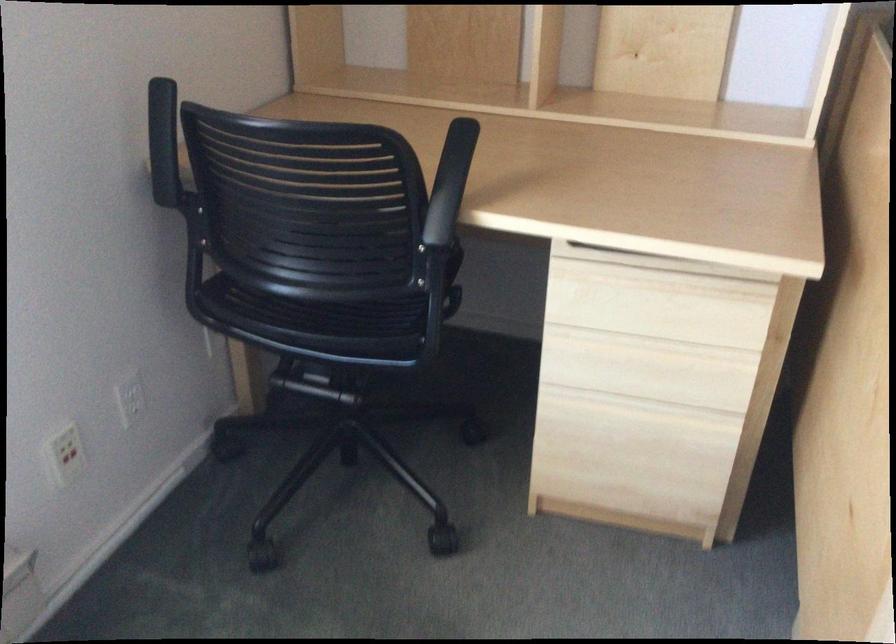
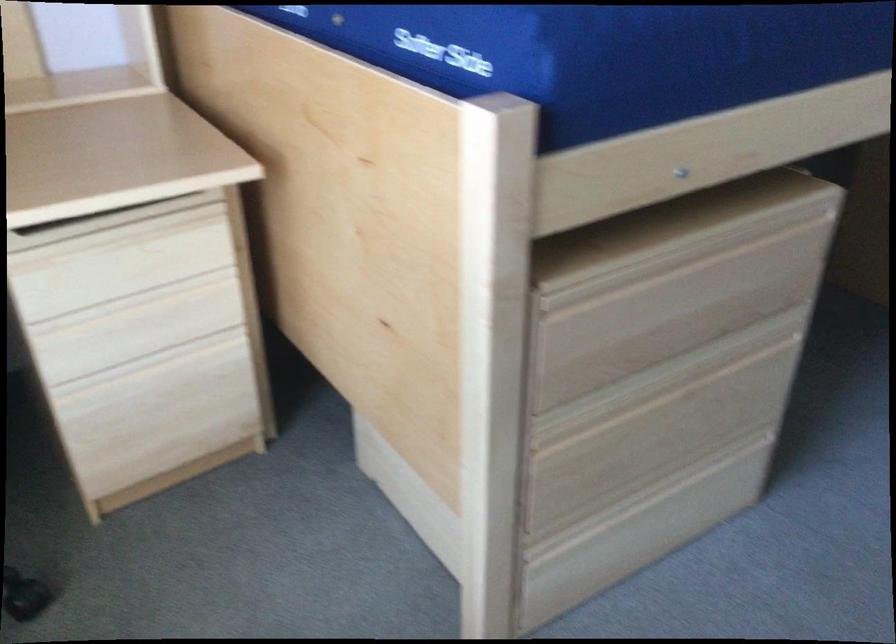
Question: Based on the continuous images, in which direction is the camera rotating? Reply with the corresponding letter.

Choices:
 (A) Left
 (B) Right
 (C) Up
 (D) Down

Answer: (B)